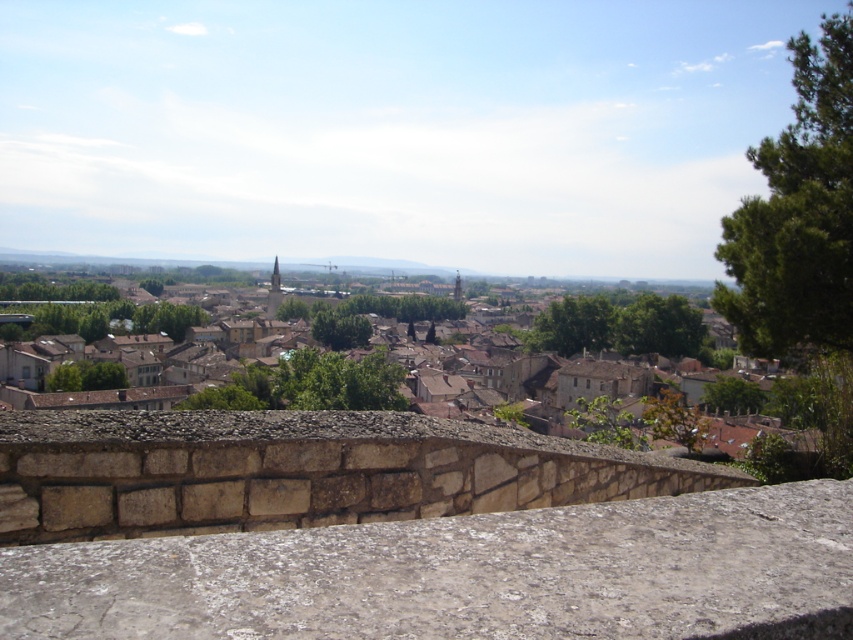
Does rough stone ledge at center appear on the right side of stone ledge at center?

In fact, rough stone ledge at center is to the left of stone ledge at center.

Identify the location of rough stone ledge at center. Image resolution: width=853 pixels, height=640 pixels. (466, 573).

Is point (437, 541) more distant than point (86, 532)?

No.

Locate an element on the screen. This screenshot has height=640, width=853. rough stone ledge at center is located at coordinates (466, 573).

The image size is (853, 640). I want to click on stone ledge at center, so click(297, 472).

Is stone ledge at center above brown stone town at center?

Yes.

Is point (19, 451) farther from camera compared to point (202, 440)?

No, (19, 451) is in front of (202, 440).

Identify the location of stone ledge at center. The height and width of the screenshot is (640, 853). (297, 472).

Is rough stone ledge at center shorter than brown stone town at center?

Yes, rough stone ledge at center is shorter than brown stone town at center.

Which is below, rough stone ledge at center or brown stone town at center?

Positioned lower is brown stone town at center.

Is point (258, 561) more distant than point (49, 404)?

No, (258, 561) is closer to viewer.

Where is `rough stone ledge at center`? rough stone ledge at center is located at coordinates (x=466, y=573).